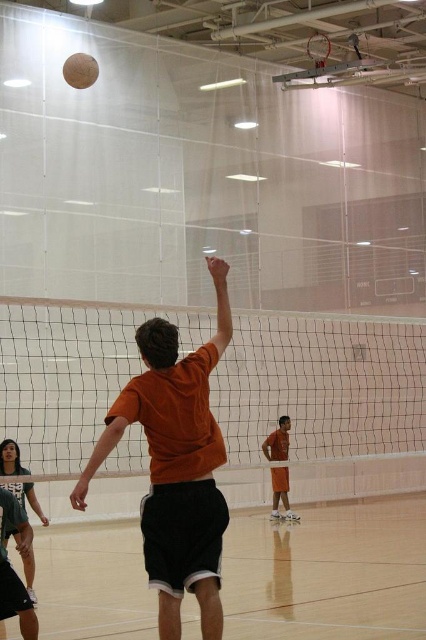
Question: Which point is farther to the camera?

Choices:
 (A) wooden floor at center
 (B) white mesh net at center
 (C) matte black shorts at lower left
 (D) beige matte volleyball at upper center

Answer: (D)

Question: Among these objects, which one is farthest from the camera?

Choices:
 (A) white mesh net at center
 (B) orange matte shirt at center

Answer: (A)

Question: Does matte black shorts at lower left have a greater width compared to orange matte shorts at center?

Choices:
 (A) no
 (B) yes

Answer: (A)

Question: Can you confirm if white mesh net at center is positioned to the left of matte black shorts at lower left?

Choices:
 (A) yes
 (B) no

Answer: (B)

Question: Which point is farther to the camera?

Choices:
 (A) click(204, 497)
 (B) click(2, 440)
 (C) click(83, 74)
 (D) click(291, 512)

Answer: (D)

Question: Is orange matte shirt at center to the right of beige matte volleyball at upper center from the viewer's perspective?

Choices:
 (A) no
 (B) yes

Answer: (B)